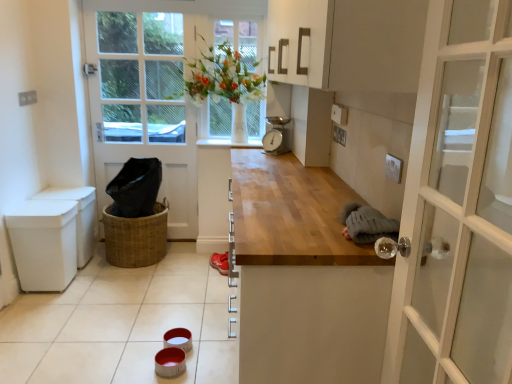
Image resolution: width=512 pixels, height=384 pixels. What are the coordinates of `free spot above white plastic bin at left (from a real-world perspective)` in the screenshot? It's located at (60, 194).